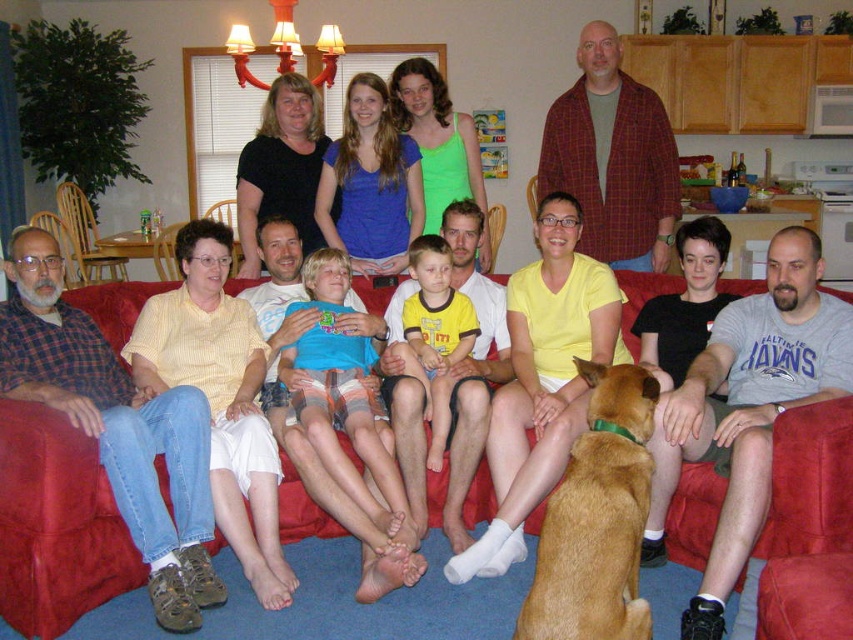
You are standing in the living room and see the image. There is a point at coordinates (543,380). What object is located at that point?

The point at coordinates (543,380) indicates the yellow matte shirt at center.

You are standing in the living room and want to place a 10 feet long ladder at the point marked as point (x=546, y=492). Is there enough space to place it?

The distance of point (x=546, y=492) from camera is 9.44 feet, so the ladder cannot be placed there as it requires 10 feet of space.

You are organizing a clothing donation drive and need to determine which items can fit into a small donation box. The box can only accommodate items smaller than the yellow matte shirt at center. Based on the scene, can the plaid flannel shirt at left fit into the box?

The plaid flannel shirt at left is smaller than the yellow matte shirt at center, so it can fit into the donation box designed for items smaller than the yellow matte shirt at center.